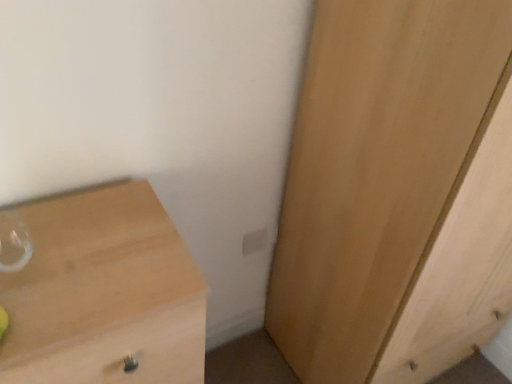
Question: From a real-world perspective, is white plastic electric outlet at center on light wood chest of drawers at lower left?

Choices:
 (A) yes
 (B) no

Answer: (A)

Question: Is white plastic electric outlet at center beside light wood chest of drawers at lower left?

Choices:
 (A) yes
 (B) no

Answer: (B)

Question: Is white plastic electric outlet at center not close to light wood chest of drawers at lower left?

Choices:
 (A) no
 (B) yes

Answer: (A)

Question: Is white plastic electric outlet at center positioned in front of light wood chest of drawers at lower left?

Choices:
 (A) yes
 (B) no

Answer: (B)

Question: Can light wood chest of drawers at lower left be found inside white plastic electric outlet at center?

Choices:
 (A) no
 (B) yes

Answer: (A)

Question: From a real-world perspective, is white plastic electric outlet at center below light wood chest of drawers at lower left?

Choices:
 (A) yes
 (B) no

Answer: (B)

Question: Can you confirm if light wood chest of drawers at lower left is thinner than white plastic electric outlet at center?

Choices:
 (A) yes
 (B) no

Answer: (B)

Question: From the image's perspective, would you say light wood chest of drawers at lower left is shown under white plastic electric outlet at center?

Choices:
 (A) yes
 (B) no

Answer: (A)

Question: Is light wood chest of drawers at lower left oriented towards white plastic electric outlet at center?

Choices:
 (A) yes
 (B) no

Answer: (B)

Question: Can you confirm if light wood chest of drawers at lower left is smaller than white plastic electric outlet at center?

Choices:
 (A) no
 (B) yes

Answer: (A)

Question: Considering the relative positions of light wood chest of drawers at lower left and white plastic electric outlet at center in the image provided, is light wood chest of drawers at lower left to the right of white plastic electric outlet at center from the viewer's perspective?

Choices:
 (A) yes
 (B) no

Answer: (B)

Question: Is light wood chest of drawers at lower left closer to camera compared to white plastic electric outlet at center?

Choices:
 (A) yes
 (B) no

Answer: (A)

Question: Is white plastic electric outlet at center inside light wood cupboard at right?

Choices:
 (A) no
 (B) yes

Answer: (A)